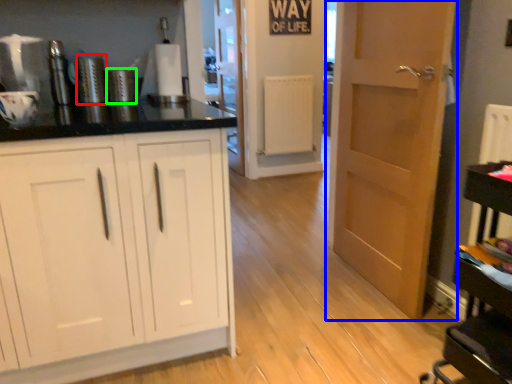
Question: Estimate the real-world distances between objects in this image. Which object is closer to appliance (highlighted by a red box), door (highlighted by a blue box) or appliance (highlighted by a green box)?

Choices:
 (A) door
 (B) appliance

Answer: (B)